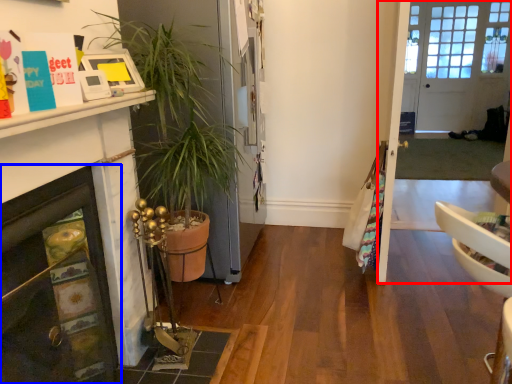
Question: Which object is further to the camera taking this photo, glass door (highlighted by a red box) or fireplace (highlighted by a blue box)?

Choices:
 (A) glass door
 (B) fireplace

Answer: (A)